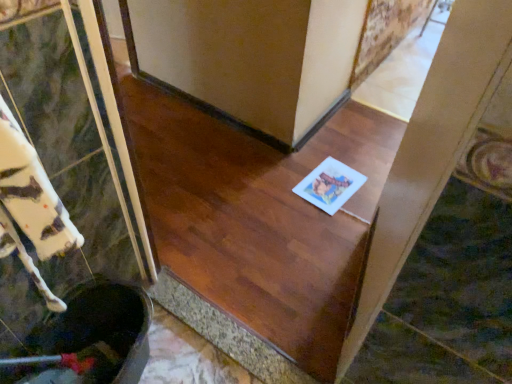
Question: Is white paper at center located within white paper at center?

Choices:
 (A) no
 (B) yes

Answer: (A)

Question: Does white paper at center have a greater width compared to white paper at center?

Choices:
 (A) yes
 (B) no

Answer: (B)

Question: From a real-world perspective, is white paper at center positioned over white paper at center based on gravity?

Choices:
 (A) yes
 (B) no

Answer: (A)

Question: Could you tell me if white paper at center is turned towards white paper at center?

Choices:
 (A) no
 (B) yes

Answer: (A)

Question: Is white paper at center smaller than white paper at center?

Choices:
 (A) no
 (B) yes

Answer: (A)

Question: Can you confirm if white paper at center is positioned to the right of white paper at center?

Choices:
 (A) no
 (B) yes

Answer: (A)

Question: Can you confirm if white paper at center is positioned to the left of white paper at center?

Choices:
 (A) yes
 (B) no

Answer: (B)

Question: Considering the relative sizes of white paper at center and white paper at center in the image provided, is white paper at center thinner than white paper at center?

Choices:
 (A) no
 (B) yes

Answer: (A)

Question: Considering the relative sizes of white paper at center and white paper at center in the image provided, is white paper at center bigger than white paper at center?

Choices:
 (A) yes
 (B) no

Answer: (B)

Question: Does white paper at center have a lesser height compared to white paper at center?

Choices:
 (A) yes
 (B) no

Answer: (A)

Question: Is white paper at center outside white paper at center?

Choices:
 (A) no
 (B) yes

Answer: (B)

Question: Is white paper at center next to white paper at center and touching it?

Choices:
 (A) yes
 (B) no

Answer: (B)

Question: Relative to white paper at center, is white paper at center in front or behind?

Choices:
 (A) behind
 (B) front

Answer: (B)